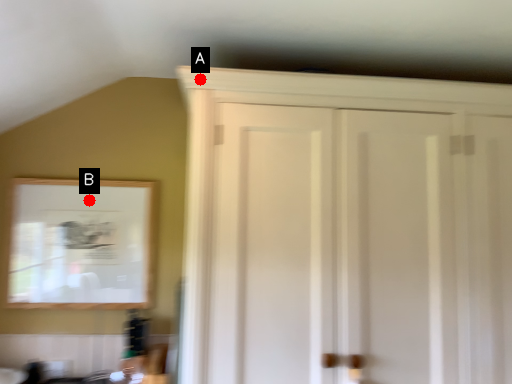
Question: Two points are circled on the image, labeled by A and B beside each circle. Which point is farther from the camera taking this photo?

Choices:
 (A) A is further
 (B) B is further

Answer: (B)